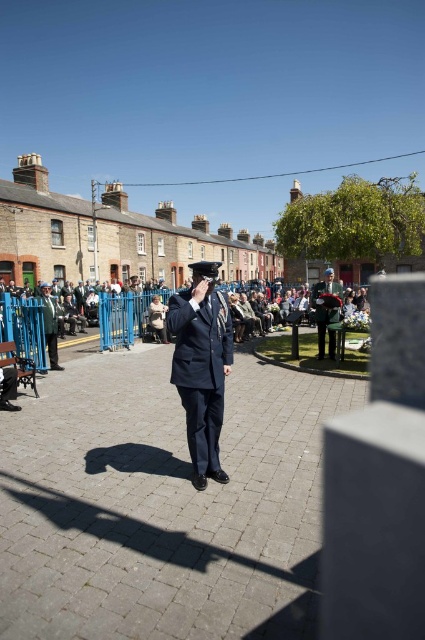
Question: Which object appears closest to the camera in this image?

Choices:
 (A) matte black uniform at center
 (B) dark blue uniform at center
 (C) green uniform at center

Answer: (B)

Question: Is dark blue uniform at center positioned behind green uniform at center?

Choices:
 (A) no
 (B) yes

Answer: (A)

Question: Can you confirm if dark blue uniform at center is positioned above green uniform at center?

Choices:
 (A) yes
 (B) no

Answer: (A)

Question: Which of the following is the farthest from the observer?

Choices:
 (A) green uniform at center
 (B) dark blue uniform at center

Answer: (A)

Question: Does dark blue uniform at center have a lesser width compared to matte black uniform at center?

Choices:
 (A) no
 (B) yes

Answer: (A)

Question: Which point appears farthest from the camera in this image?

Choices:
 (A) (172, 305)
 (B) (51, 324)

Answer: (B)